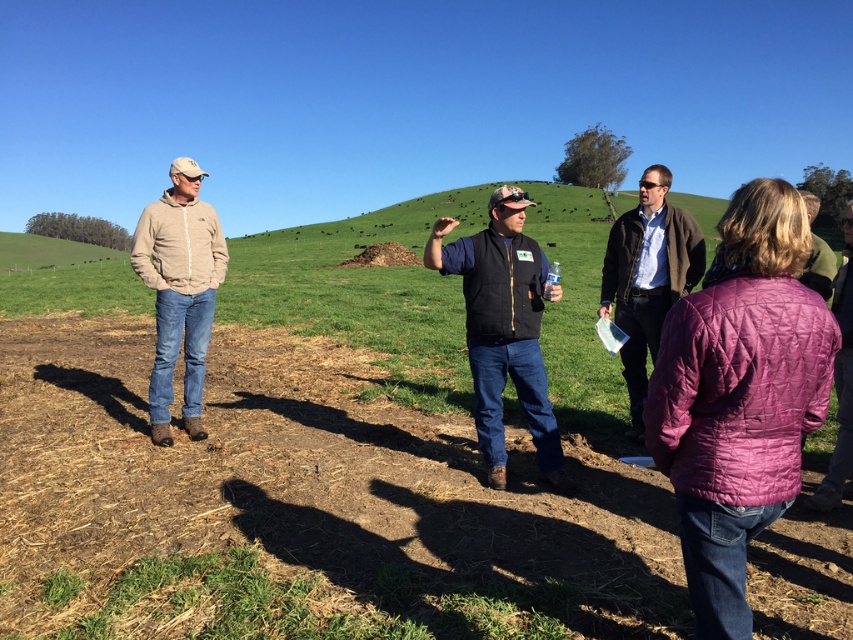
You are a photographer trying to capture a group photo of the people in the scene. You notice the black softshell vest at center and the brown woolen sweater at center. Which clothing item should you focus on to ensure the person wearing it is in the foreground of your photo?

The black softshell vest at center is in front of the brown woolen sweater at center, so focusing on the black softshell vest at center will ensure the person wearing it is in the foreground.

Consider the image. You are standing at the point marked as point (299,506). What is the name of the object located at this point?

The object located at point (299,506) is the brown dry dirt field at center.